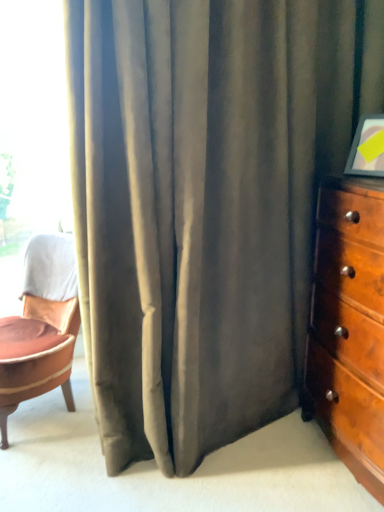
The width and height of the screenshot is (384, 512). Describe the element at coordinates (40, 328) in the screenshot. I see `leather cushioned chair at left` at that location.

The image size is (384, 512). Describe the element at coordinates (349, 327) in the screenshot. I see `wooden dresser at right` at that location.

The width and height of the screenshot is (384, 512). In order to click on transparent glass window at upper left in this screenshot , I will do (x=31, y=135).

Is leather cushioned chair at left shorter than wooden dresser at right?

Yes.

Do you think leather cushioned chair at left is within wooden dresser at right, or outside of it?

leather cushioned chair at left is spatially situated outside wooden dresser at right.

The width and height of the screenshot is (384, 512). I want to click on chair that appears on the left of wooden dresser at right, so click(x=40, y=328).

From the image's perspective, which object appears higher, leather cushioned chair at left or wooden dresser at right?

wooden dresser at right, from the image's perspective.

Can you tell me how much transparent glass window at upper left and leather cushioned chair at left differ in facing direction?

The angle between the facing direction of transparent glass window at upper left and the facing direction of leather cushioned chair at left is 59.5 degrees.

Is transparent glass window at upper left wider or thinner than leather cushioned chair at left?

In the image, transparent glass window at upper left appears to be more narrow than leather cushioned chair at left.

Which object is positioned more to the right, transparent glass window at upper left or leather cushioned chair at left?

leather cushioned chair at left.

Considering the points (43, 33) and (364, 240), which point is in front, point (43, 33) or point (364, 240)?

Positioned in front is point (364, 240).

Which object is positioned more to the left, transparent glass window at upper left or wooden dresser at right?

Positioned to the left is transparent glass window at upper left.

The image size is (384, 512). Identify the location of the chest of drawers directly beneath the transparent glass window at upper left (from a real-world perspective). (349, 327).

Which of these two, leather cushioned chair at left or transparent glass window at upper left, stands shorter?

Standing shorter between the two is leather cushioned chair at left.

Is leather cushioned chair at left positioned behind transparent glass window at upper left?

No, leather cushioned chair at left is closer to the viewer.

Is leather cushioned chair at left facing away from transparent glass window at upper left?

No, leather cushioned chair at left's orientation is not away from transparent glass window at upper left.

Locate an element on the screen. chair located underneath the transparent glass window at upper left (from a real-world perspective) is located at coordinates (40, 328).

How many degrees apart are the facing directions of wooden dresser at right and leather cushioned chair at left?

The angle between the facing direction of wooden dresser at right and the facing direction of leather cushioned chair at left is 30.8 degrees.

From the picture: Which object is wider, wooden dresser at right or leather cushioned chair at left?

With larger width is leather cushioned chair at left.

Relative to leather cushioned chair at left, is wooden dresser at right in front or behind?

In the image, wooden dresser at right appears in front of leather cushioned chair at left.

Does point (321, 293) come in front of point (6, 402)?

No, (321, 293) is behind (6, 402).

From a real-world perspective, which object stands above the other?

From a 3D spatial view, transparent glass window at upper left is above.

The height and width of the screenshot is (512, 384). What are the coordinates of `the chest of drawers that is in front of the transparent glass window at upper left` in the screenshot? It's located at (349, 327).

Which is closer to the camera, (341, 256) or (24, 77)?

The point (341, 256) is closer.

Is wooden dresser at right far away from transparent glass window at upper left?

Yes, wooden dresser at right is far from transparent glass window at upper left.

Identify the location of the chest of drawers above the leather cushioned chair at left (from a real-world perspective). (349, 327).

This screenshot has width=384, height=512. In order to click on window that is above the leather cushioned chair at left (from the image's perspective) in this screenshot , I will do `click(31, 135)`.

When comparing their distances from transparent glass window at upper left, does wooden dresser at right or leather cushioned chair at left seem further?

wooden dresser at right lies further to transparent glass window at upper left than the other object.

When comparing their distances from wooden dresser at right, does transparent glass window at upper left or leather cushioned chair at left seem closer?

Based on the image, leather cushioned chair at left appears to be nearer to wooden dresser at right.

Considering their positions, is leather cushioned chair at left positioned further to wooden dresser at right than transparent glass window at upper left?

transparent glass window at upper left lies further to wooden dresser at right than the other object.

Which object lies nearer to the anchor point leather cushioned chair at left, wooden dresser at right or transparent glass window at upper left?

The object closer to leather cushioned chair at left is transparent glass window at upper left.

Based on their spatial positions, is transparent glass window at upper left or wooden dresser at right further from leather cushioned chair at left?

wooden dresser at right is positioned further to the anchor leather cushioned chair at left.

Looking at the image, which one is located further to transparent glass window at upper left, leather cushioned chair at left or wooden dresser at right?

wooden dresser at right is further to transparent glass window at upper left.

At what (x,y) coordinates should I click in order to perform the action: click on chair between transparent glass window at upper left and wooden dresser at right from left to right. Please return your answer as a coordinate pair (x, y). Looking at the image, I should click on (40, 328).